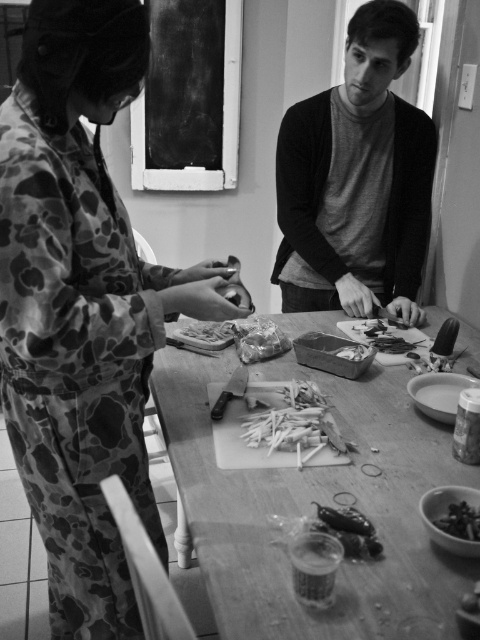
You are a chef preparing a dish and need to place the smooth plastic grapes at lower right onto the wooden cutting board at center. Can you directly move the grapes onto the board without moving any other objects?

The wooden cutting board at center is in front of the smooth plastic grapes at lower right, meaning the grapes are behind the board. To move the grapes onto the board, you would need to move the board first or navigate around it, so you cannot directly place them without moving other objects.

Looking at this image, you are organizing a small dinner party and need to arrange the wooden cutting board at center and the smooth plastic grapes at lower right on your dining table. Given their sizes, which object should be placed first to ensure proper spacing?

The wooden cutting board at center should be placed first because it is larger than the smooth plastic grapes at lower right, allowing for better spatial planning.